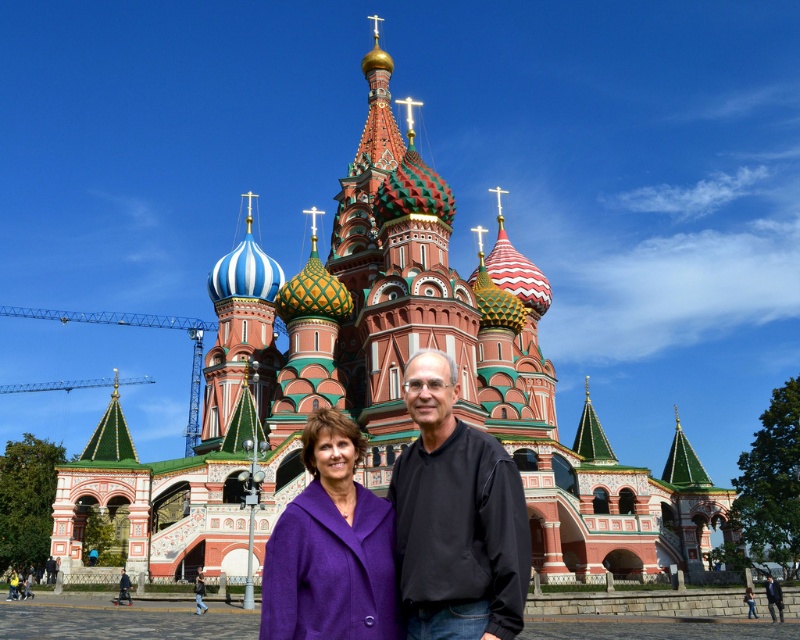
You are a photographer planning to take a photo of the two people wearing the black matte shirt at center and the black smooth suit at center. To ensure both are fully visible in the frame, which direction should you position yourself relative to the subjects?

You should position yourself to the right of the subjects so that the black matte shirt at center and the black smooth suit at center are both fully visible in the frame.

You are standing in front of St. Basil Cathedral and want to take a photo. You have two points marked on your camera screen at coordinates point (448, 412) and point (276, 627). Which point is closer to your camera?

Point (276, 627) is closer to the camera because it is less further away than point (448, 412).